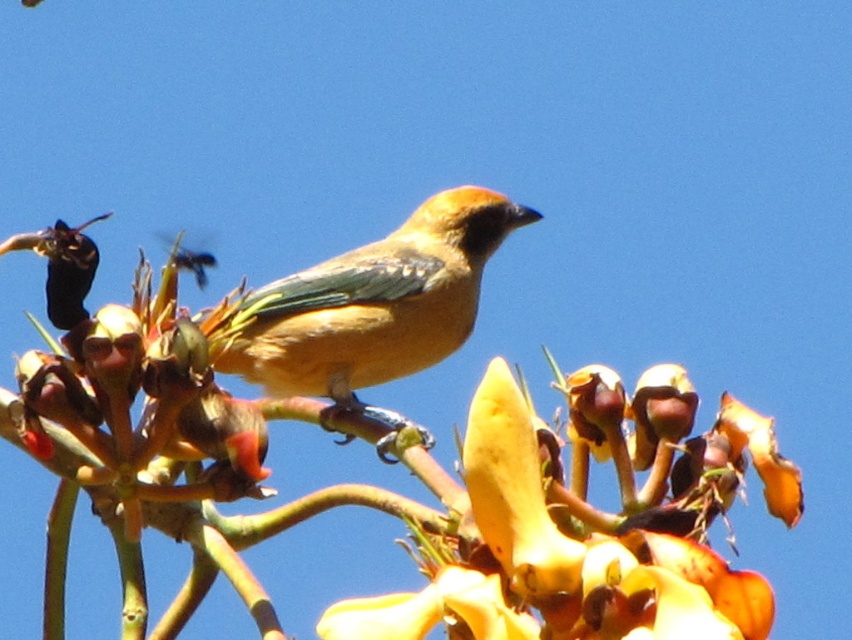
Question: Considering the real-world distances, which object is closest to the matte orange bird at center?

Choices:
 (A) yellow papery flower at center
 (B) smooth yellow flower at center

Answer: (B)

Question: Is the position of smooth yellow flower at center less distant than that of yellow papery flower at center?

Choices:
 (A) yes
 (B) no

Answer: (A)

Question: Which point is farther to the camera?

Choices:
 (A) yellow papery flower at center
 (B) smooth yellow flower at center

Answer: (A)

Question: Is the position of smooth yellow flower at center more distant than that of yellow papery flower at center?

Choices:
 (A) yes
 (B) no

Answer: (B)

Question: Where is smooth yellow flower at center located in relation to matte orange bird at center in the image?

Choices:
 (A) right
 (B) left

Answer: (A)

Question: Which object appears farthest from the camera in this image?

Choices:
 (A) smooth yellow flower at center
 (B) yellow papery flower at center

Answer: (B)